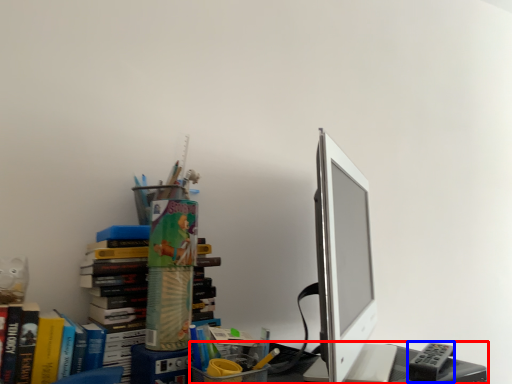
Question: Which object appears closest to the camera in this image, desk (highlighted by a red box) or stationery (highlighted by a blue box)?

Choices:
 (A) desk
 (B) stationery

Answer: (A)